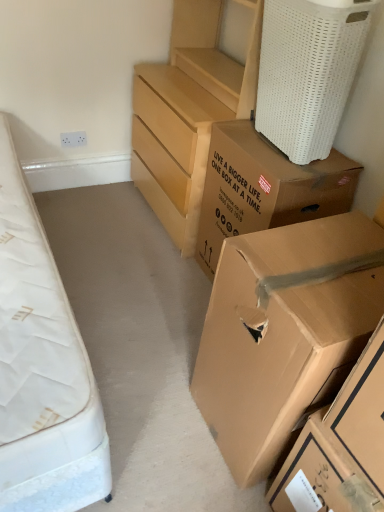
Question: Considering the relative sizes of matte wood chest of drawers at center and brown cardboard box at lower right, the first box positioned from the bottom, in the image provided, is matte wood chest of drawers at center thinner than brown cardboard box at lower right, the first box positioned from the bottom,?

Choices:
 (A) yes
 (B) no

Answer: (B)

Question: Does matte wood chest of drawers at center have a smaller size compared to brown cardboard box at lower right, the first box positioned from the bottom?

Choices:
 (A) yes
 (B) no

Answer: (B)

Question: Is matte wood chest of drawers at center oriented away from brown cardboard box at lower right, the third box from the top?

Choices:
 (A) yes
 (B) no

Answer: (B)

Question: Is matte wood chest of drawers at center directly adjacent to brown cardboard box at lower right, the first box positioned from the bottom?

Choices:
 (A) yes
 (B) no

Answer: (B)

Question: From a real-world perspective, is matte wood chest of drawers at center located higher than brown cardboard box at lower right, the third box from the top?

Choices:
 (A) yes
 (B) no

Answer: (A)

Question: From the image's perspective, would you say matte wood chest of drawers at center is positioned over brown cardboard box at lower right, the third box from the top?

Choices:
 (A) no
 (B) yes

Answer: (B)

Question: Is brown cardboard box at lower right, the first box positioned from the bottom, positioned behind white woven laundry basket at upper right?

Choices:
 (A) yes
 (B) no

Answer: (B)

Question: Is brown cardboard box at lower right, the first box positioned from the bottom, positioned with its back to white woven laundry basket at upper right?

Choices:
 (A) no
 (B) yes

Answer: (A)

Question: Is brown cardboard box at lower right, the first box positioned from the bottom, to the right of white woven laundry basket at upper right from the viewer's perspective?

Choices:
 (A) yes
 (B) no

Answer: (A)

Question: From the image's perspective, would you say brown cardboard box at lower right, the third box from the top, is positioned over white woven laundry basket at upper right?

Choices:
 (A) no
 (B) yes

Answer: (A)

Question: Is brown cardboard box at lower right, the third box from the top, thinner than white woven laundry basket at upper right?

Choices:
 (A) no
 (B) yes

Answer: (A)

Question: Can you see brown cardboard box at lower right, the third box from the top, touching white woven laundry basket at upper right?

Choices:
 (A) no
 (B) yes

Answer: (A)

Question: From the image's perspective, is brown cardboard box at upper right, the 3th box in the bottom-to-top sequence, above brown cardboard box at lower right, the third box from the top?

Choices:
 (A) no
 (B) yes

Answer: (B)